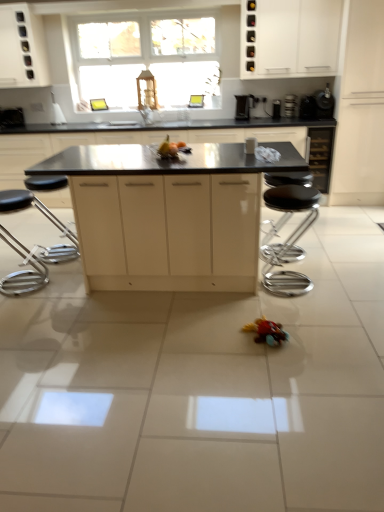
Locate an element on the screen. Image resolution: width=384 pixels, height=512 pixels. black glossy coffee maker at upper right, which ranks as the third appliance in back-to-front order is located at coordinates (317, 105).

Measure the distance between point (136, 237) and camera.

Point (136, 237) and camera are 9.48 feet apart.

Describe the element at coordinates (168, 231) in the screenshot. This screenshot has height=512, width=384. I see `matte black cabinet at center, positioned as the third cabinetry in left-to-right order` at that location.

You are a GUI agent. You are given a task and a screenshot of the screen. Output one action in this format:
    pyautogui.click(x=<x>, y=<y>)
    Task: Click on the white matte cabinet at upper right, which appears as the third cabinetry when viewed from the right
    
    Given the screenshot: What is the action you would take?
    pyautogui.click(x=289, y=38)

This screenshot has height=512, width=384. What do you see at coordinates (290, 106) in the screenshot? I see `metallic silver wine cooler at upper right, the 2th appliance positioned from the left` at bounding box center [290, 106].

Where is `black glossy coffee maker at upper right, the first appliance positioned from the front`? black glossy coffee maker at upper right, the first appliance positioned from the front is located at coordinates (317, 105).

From a real-world perspective, which object rests below the other?

polished chrome bar stool at right, which appears as the second bar stool when viewed from the left.

Is polished chrome bar stool at right, which appears as the second bar stool when viewed from the left, facing away from black matte island at center, positioned as the fifth cabinetry in right-to-left order?

No, polished chrome bar stool at right, which appears as the second bar stool when viewed from the left, is not facing away from black matte island at center, positioned as the fifth cabinetry in right-to-left order.

Considering the sizes of objects polished chrome bar stool at right, which is the first bar stool in right-to-left order, and black matte island at center, which appears as the 2th cabinetry when viewed from the left, in the image provided, who is smaller, polished chrome bar stool at right, which is the first bar stool in right-to-left order, or black matte island at center, which appears as the 2th cabinetry when viewed from the left,?

polished chrome bar stool at right, which is the first bar stool in right-to-left order, is smaller.

Between point (272, 189) and point (47, 132), which one is positioned behind?

The point (47, 132) is farther.

Consider the image. Is satin black coffee machine at center facing away from black glossy coffee maker at upper right, the first appliance positioned from the front?

satin black coffee machine at center is not turned away from black glossy coffee maker at upper right, the first appliance positioned from the front.

Looking at this image, relative to black glossy coffee maker at upper right, the first appliance positioned from the front, is satin black coffee machine at center in front or behind?

satin black coffee machine at center is positioned farther from the viewer than black glossy coffee maker at upper right, the first appliance positioned from the front.

From a real-world perspective, is satin black coffee machine at center below black glossy coffee maker at upper right, the third appliance positioned from the left?

Yes, from a real-world perspective, satin black coffee machine at center is below black glossy coffee maker at upper right, the third appliance positioned from the left.

From the picture: Is matte yellow fruit at center, the 1th toy viewed from the back, taller than white matte cabinet at upper right, placed as the fourth cabinetry when sorted from left to right?

No, matte yellow fruit at center, the 1th toy viewed from the back, is not taller than white matte cabinet at upper right, placed as the fourth cabinetry when sorted from left to right.

From a real-world perspective, is matte yellow fruit at center, placed as the 1th toy when sorted from top to bottom, physically located above or below white matte cabinet at upper right, which appears as the third cabinetry when viewed from the right?

Clearly, from a real-world perspective, matte yellow fruit at center, placed as the 1th toy when sorted from top to bottom, is below white matte cabinet at upper right, which appears as the third cabinetry when viewed from the right.

Is matte yellow fruit at center, the 1th toy viewed from the back, aimed at white matte cabinet at upper right, which appears as the third cabinetry when viewed from the right?

No, matte yellow fruit at center, the 1th toy viewed from the back, is not oriented towards white matte cabinet at upper right, which appears as the third cabinetry when viewed from the right.

Based on the photo, how many degrees apart are the facing directions of matte yellow fruit at center, marked as the 2th toy in a bottom-to-top arrangement, and white matte cabinet at upper right, which appears as the third cabinetry when viewed from the right?

The angular difference between matte yellow fruit at center, marked as the 2th toy in a bottom-to-top arrangement, and white matte cabinet at upper right, which appears as the third cabinetry when viewed from the right, is 180 degrees.

How much distance is there between metallic silver wine cooler at upper right, which ranks as the second appliance in front-to-back order, and matte black cabinet at center, positioned as the third cabinetry in left-to-right order?

metallic silver wine cooler at upper right, which ranks as the second appliance in front-to-back order, and matte black cabinet at center, positioned as the third cabinetry in left-to-right order, are 2.37 meters apart.

Can you tell me how much metallic silver wine cooler at upper right, the second appliance from the right, and matte black cabinet at center, marked as the 4th cabinetry in a right-to-left arrangement, differ in facing direction?

They differ by 89.5 degrees in their facing directions.

From a real-world perspective, is metallic silver wine cooler at upper right, positioned as the second appliance in back-to-front order, over matte black cabinet at center, positioned as the third cabinetry in left-to-right order?

Yes.

Considering the sizes of objects metallic silver wine cooler at upper right, which ranks as the second appliance in front-to-back order, and matte black cabinet at center, positioned as the third cabinetry in left-to-right order, in the image provided, who is smaller, metallic silver wine cooler at upper right, which ranks as the second appliance in front-to-back order, or matte black cabinet at center, positioned as the third cabinetry in left-to-right order,?

metallic silver wine cooler at upper right, which ranks as the second appliance in front-to-back order.

Can you confirm if matte black cabinet at center, positioned as the third cabinetry in left-to-right order, is positioned to the right of matte yellow fruit at center, placed as the 1th toy when sorted from top to bottom?

Correct, you'll find matte black cabinet at center, positioned as the third cabinetry in left-to-right order, to the right of matte yellow fruit at center, placed as the 1th toy when sorted from top to bottom.

Does matte black cabinet at center, positioned as the third cabinetry in left-to-right order, have a greater height compared to matte yellow fruit at center, marked as the 2th toy in a bottom-to-top arrangement?

Yes, matte black cabinet at center, positioned as the third cabinetry in left-to-right order, is taller than matte yellow fruit at center, marked as the 2th toy in a bottom-to-top arrangement.

Based on the photo, which is less distant, (205, 178) or (164, 158)?

Point (205, 178) is positioned closer to the camera compared to point (164, 158).

Is matte black cabinet at center, positioned as the third cabinetry in left-to-right order, further to camera compared to matte yellow fruit at center, which is counted as the second toy, starting from the front?

No, matte black cabinet at center, positioned as the third cabinetry in left-to-right order, is closer to the camera.

Which is correct: black matte island at center, positioned as the fifth cabinetry in right-to-left order, is inside black glass wine cabinet at right, the 2th cabinetry in the right-to-left sequence, or outside of it?

black matte island at center, positioned as the fifth cabinetry in right-to-left order, is outside black glass wine cabinet at right, the 2th cabinetry in the right-to-left sequence.

Starting from the black matte island at center, positioned as the fifth cabinetry in right-to-left order, which cabinetry is the 1st one behind? Please provide its 2D coordinates.

[(321, 156)]

In terms of height, does black matte island at center, positioned as the fifth cabinetry in right-to-left order, look taller or shorter compared to black glass wine cabinet at right, the 2th cabinetry in the right-to-left sequence?

Considering their sizes, black matte island at center, positioned as the fifth cabinetry in right-to-left order, has more height than black glass wine cabinet at right, the 2th cabinetry in the right-to-left sequence.

Does black matte island at center, which appears as the 2th cabinetry when viewed from the left, appear on the right side of black glass wine cabinet at right, marked as the fifth cabinetry in a left-to-right arrangement?

No, black matte island at center, which appears as the 2th cabinetry when viewed from the left, is not to the right of black glass wine cabinet at right, marked as the fifth cabinetry in a left-to-right arrangement.

Find the location of a particular element. This screenshot has width=384, height=512. the 1st cabinetry positioned above the metallic silver wine cooler at upper right, the 2th appliance positioned from the left (from the image's perspective) is located at coordinates (289, 38).

Is white matte cabinet at upper right, placed as the fourth cabinetry when sorted from left to right, bigger or smaller than metallic silver wine cooler at upper right, positioned as the second appliance in back-to-front order?

In the image, white matte cabinet at upper right, placed as the fourth cabinetry when sorted from left to right, appears to be larger than metallic silver wine cooler at upper right, positioned as the second appliance in back-to-front order.

Consider the image. Can you confirm if white matte cabinet at upper right, which appears as the third cabinetry when viewed from the right, is positioned to the right of metallic silver wine cooler at upper right, positioned as the second appliance in back-to-front order?

No, white matte cabinet at upper right, which appears as the third cabinetry when viewed from the right, is not to the right of metallic silver wine cooler at upper right, positioned as the second appliance in back-to-front order.

Is point (277, 16) less distant than point (289, 101)?

Yes, it is in front of point (289, 101).

This screenshot has height=512, width=384. Find the location of `the 2nd cabinetry above the polished chrome bar stool at right, which is the first bar stool in right-to-left order (from the image's perspective)`. the 2nd cabinetry above the polished chrome bar stool at right, which is the first bar stool in right-to-left order (from the image's perspective) is located at coordinates (139, 139).

What are the coordinates of `coffee machine located on the left of black glossy coffee maker at upper right, the third appliance positioned from the left` in the screenshot? It's located at (244, 106).

Which object lies further to the anchor point white matte cabinet at right, arranged as the 6th cabinetry when viewed from the left, black glass wine cabinet at right, the 2th cabinetry in the right-to-left sequence, or white matte cabinet at upper right, placed as the fourth cabinetry when sorted from left to right?

The object further to white matte cabinet at right, arranged as the 6th cabinetry when viewed from the left, is white matte cabinet at upper right, placed as the fourth cabinetry when sorted from left to right.

From the image, which object appears to be farther from white glossy cabinet at upper left, the 6th cabinetry when ordered from right to left, rubberized red toy car at lower center, the 1th toy positioned from the front, or polished chrome bar stool at right, which appears as the second bar stool when viewed from the left?

rubberized red toy car at lower center, the 1th toy positioned from the front.

Estimate the real-world distances between objects in this image. Which object is further from metallic silver wine cooler at upper right, positioned as the second appliance in back-to-front order, white matte cabinet at right, arranged as the 6th cabinetry when viewed from the left, or white matte cabinet at upper right, which appears as the third cabinetry when viewed from the right?

white matte cabinet at right, arranged as the 6th cabinetry when viewed from the left, is further to metallic silver wine cooler at upper right, positioned as the second appliance in back-to-front order.

Which object lies nearer to the anchor point yellow matte fruit at center, polished chrome bar stool at left, which ranks as the 2th bar stool in right-to-left order, or black glossy coffee maker at upper right, which ranks as the first appliance in right-to-left order?

Among the two, polished chrome bar stool at left, which ranks as the 2th bar stool in right-to-left order, is located nearer to yellow matte fruit at center.

Looking at the image, which one is located further to black glass wine cabinet at right, marked as the fifth cabinetry in a left-to-right arrangement, rubberized red toy car at lower center, the 1th toy positioned from the front, or metallic silver toaster at left, arranged as the 3th appliance when viewed from the front?

metallic silver toaster at left, arranged as the 3th appliance when viewed from the front, lies further to black glass wine cabinet at right, marked as the fifth cabinetry in a left-to-right arrangement, than the other object.

Considering their positions, is polished chrome bar stool at right, which is the first bar stool in right-to-left order, positioned further to metallic silver toaster at left, placed as the 1th appliance when sorted from left to right, than satin black coffee machine at center?

Based on the image, polished chrome bar stool at right, which is the first bar stool in right-to-left order, appears to be further to metallic silver toaster at left, placed as the 1th appliance when sorted from left to right.

Considering their positions, is matte black cabinet at center, marked as the 4th cabinetry in a right-to-left arrangement, positioned further to polished chrome bar stool at left, which ranks as the 2th bar stool in right-to-left order, than white matte cabinet at upper right, which appears as the third cabinetry when viewed from the right?

Among the two, white matte cabinet at upper right, which appears as the third cabinetry when viewed from the right, is located further to polished chrome bar stool at left, which ranks as the 2th bar stool in right-to-left order.

Based on their spatial positions, is matte yellow fruit at center, which is counted as the second toy, starting from the front, or black matte island at center, which appears as the 2th cabinetry when viewed from the left, further from rubberized red toy car at lower center, marked as the first toy in a bottom-to-top arrangement?

Among the two, black matte island at center, which appears as the 2th cabinetry when viewed from the left, is located further to rubberized red toy car at lower center, marked as the first toy in a bottom-to-top arrangement.

Locate an element on the screen. This screenshot has height=512, width=384. appliance located between yellow matte fruit at center and metallic silver wine cooler at upper right, which ranks as the second appliance in front-to-back order, in the depth direction is located at coordinates (317, 105).

At what (x,y) coordinates should I click in order to perform the action: click on appliance positioned between matte yellow fruit at center, which is counted as the second toy, starting from the front, and satin black coffee machine at center from near to far. Please return your answer as a coordinate pair (x, y). The image size is (384, 512). Looking at the image, I should click on (317, 105).

Where is `coffee machine located between metallic silver toaster at left, arranged as the 3th appliance when viewed from the front, and black glossy coffee maker at upper right, the third appliance positioned from the left, in the left-right direction`? The width and height of the screenshot is (384, 512). coffee machine located between metallic silver toaster at left, arranged as the 3th appliance when viewed from the front, and black glossy coffee maker at upper right, the third appliance positioned from the left, in the left-right direction is located at coordinates (244, 106).

Locate an element on the screen. food between matte yellow fruit at center, arranged as the 2th toy when viewed from the right, and black matte island at center, which appears as the 2th cabinetry when viewed from the left, from front to back is located at coordinates (168, 149).